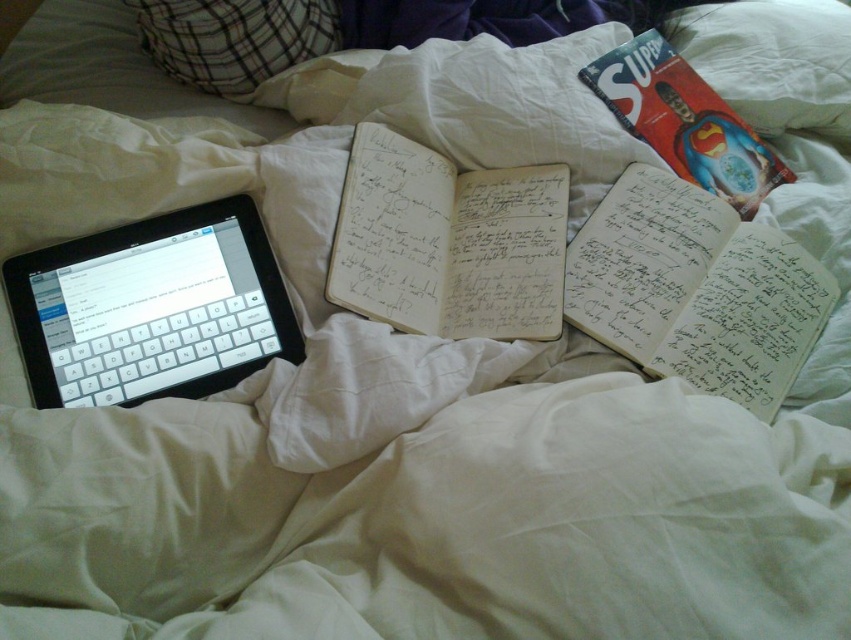
Question: Can you confirm if black matte tablet at left is positioned to the right of white paper notebook at center?

Choices:
 (A) no
 (B) yes

Answer: (A)

Question: Which is farther from the white paper journal at center right?

Choices:
 (A) superman comic book at upper right
 (B) black matte tablet at left
 (C) plaid fabric pillow at upper left
 (D) white paper notebook at center

Answer: (C)

Question: Is black matte tablet at left bigger than white soft pillow at upper right?

Choices:
 (A) no
 (B) yes

Answer: (A)

Question: Based on their relative distances, which object is nearer to the plaid fabric pillow at upper left?

Choices:
 (A) black matte tablet at left
 (B) white paper notebook at center

Answer: (B)

Question: Does black matte tablet at left have a lesser width compared to white soft pillow at upper right?

Choices:
 (A) no
 (B) yes

Answer: (A)

Question: Estimate the real-world distances between objects in this image. Which object is farther from the white soft pillow at upper right?

Choices:
 (A) white paper notebook at center
 (B) black matte tablet at left
 (C) plaid fabric pillow at upper left
 (D) white paper journal at center right

Answer: (B)